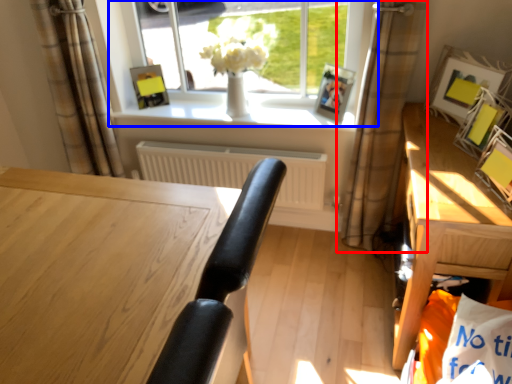
Question: Which object appears farthest to the camera in this image, curtain (highlighted by a red box) or window (highlighted by a blue box)?

Choices:
 (A) curtain
 (B) window

Answer: (B)